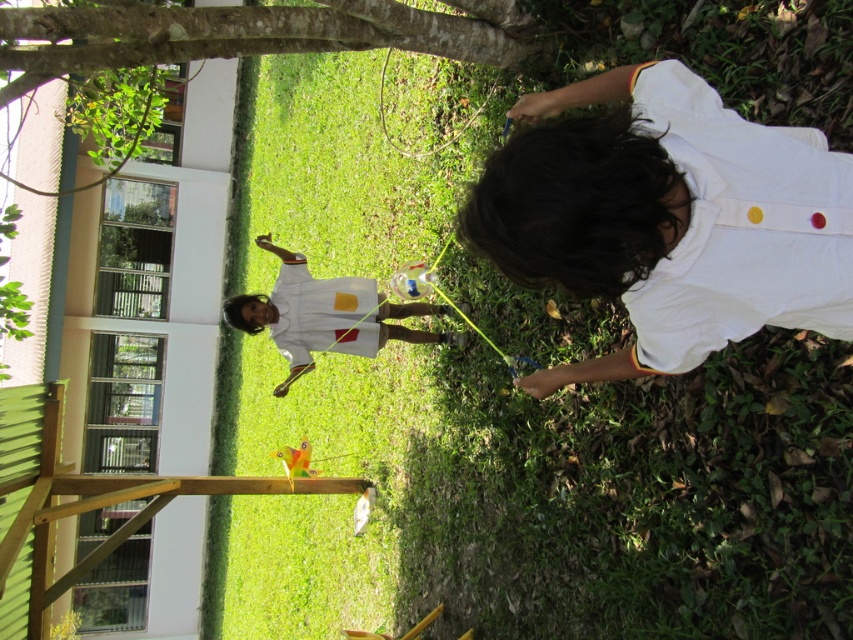
You are a photographer trying to capture both the white cotton shirt at center and the white matte shirt at center in a single shot. Since you can only focus on one shirt clearly, which one will appear sharper in the photo?

The white cotton shirt at center will appear sharper in the photo because it is closer to the viewer than the white matte shirt at center.

Based on the scene description, where is the point located at coordinates (543, 497)?

The point at coordinates (543, 497) is located on the green grass at center.